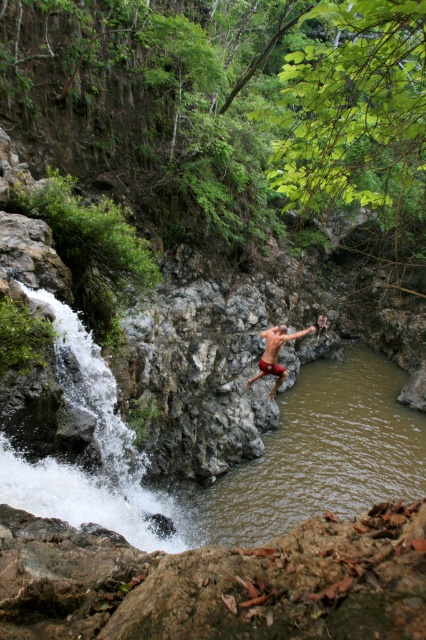
You are a safety inspector assessing the cliff jumping area. The brown rock stream at center is the landing zone for jumpers. The matte red shorts at center belongs to a jumper midair. Given that the recommended safe distance between the jumper and the rocks is at least 4 meters, is this jump compliant with safety standards?

The brown rock stream at center is 3.71 meters away from the matte red shorts at center, which is less than the required 4 meters. Therefore, this jump does not comply with safety standards.

What are the coordinates of the brown rock stream at center?

The brown rock stream at center is located at coordinates point (x=316, y=456).